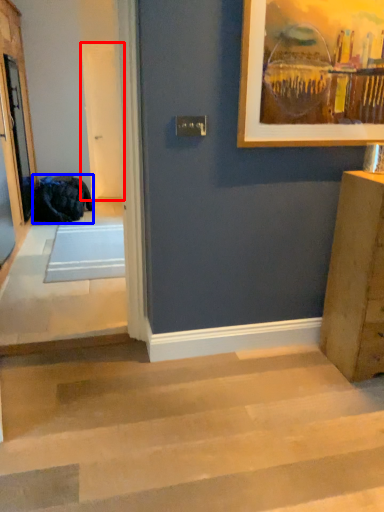
Question: Which point is closer to the camera, screen door (highlighted by a red box) or laundry (highlighted by a blue box)?

Choices:
 (A) screen door
 (B) laundry

Answer: (B)